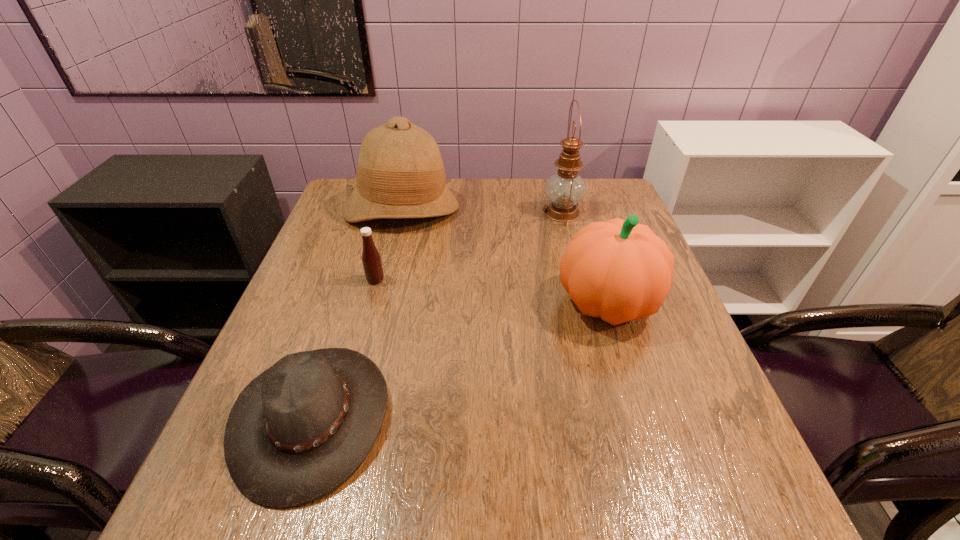
Find the location of a particular element. This screenshot has height=540, width=960. oil lamp is located at coordinates (565, 189).

In order to click on the taller hat in this screenshot , I will do `click(400, 174)`.

Where is `pumpkin`? This screenshot has height=540, width=960. pumpkin is located at coordinates (618, 270).

Identify the location of the fourth tallest object. (371, 259).

I want to click on the shorter hat, so click(x=295, y=433).

Identify the location of the shortest object. The width and height of the screenshot is (960, 540). (295, 433).

Find the location of `vacant position located on the front of the oil lamp`. vacant position located on the front of the oil lamp is located at coordinates (569, 241).

Where is `free spot located 0.190m on the front-facing side of the taller hat`? free spot located 0.190m on the front-facing side of the taller hat is located at coordinates (383, 281).

Identify the location of vacant area situated on the back of the pumpkin. This screenshot has height=540, width=960. (572, 188).

The image size is (960, 540). Identify the location of blank space located 0.300m on the front of the Tabasco sauce. (345, 393).